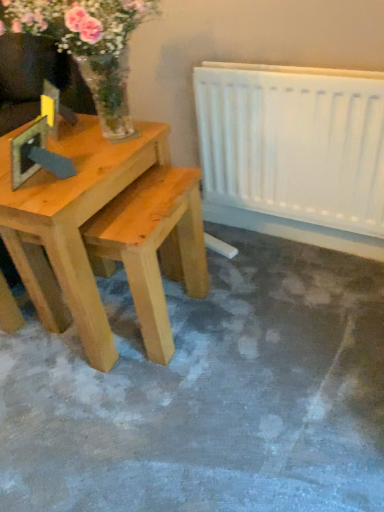
What do you see at coordinates (294, 142) in the screenshot?
I see `white plastic radiator at right` at bounding box center [294, 142].

At what (x,y) coordinates should I click in order to perform the action: click on light brown wood table at left. Please return your answer as a coordinate pair (x, y). Image resolution: width=384 pixels, height=512 pixels. Looking at the image, I should click on (73, 223).

How different are the orientations of white plastic radiator at right and translucent glass vase at upper left in degrees?

The facing directions of white plastic radiator at right and translucent glass vase at upper left are 3.17 degrees apart.

From the image's perspective, is white plastic radiator at right beneath translucent glass vase at upper left?

Correct, white plastic radiator at right appears lower than translucent glass vase at upper left in the image.

Is white plastic radiator at right not within translucent glass vase at upper left?

Yes, white plastic radiator at right is outside of translucent glass vase at upper left.

From a real-world perspective, relative to translucent glass vase at upper left, is white plastic radiator at right vertically above or below?

In terms of real-world spatial position, white plastic radiator at right is below translucent glass vase at upper left.

What's the angular difference between translucent glass vase at upper left and white plastic radiator at right's facing directions?

There is a 3.17-degree angle between the facing directions of translucent glass vase at upper left and white plastic radiator at right.

Considering the sizes of objects translucent glass vase at upper left and white plastic radiator at right in the image provided, who is taller, translucent glass vase at upper left or white plastic radiator at right?

white plastic radiator at right.

Consider the image. From a real-world perspective, is translucent glass vase at upper left physically located above or below white plastic radiator at right?

translucent glass vase at upper left is situated higher than white plastic radiator at right in the real world.

Would you say translucent glass vase at upper left is a long distance from white plastic radiator at right?

No.

In terms of height, does translucent glass vase at upper left look taller or shorter compared to light brown wood table at left?

In the image, translucent glass vase at upper left appears to be shorter than light brown wood table at left.

How different are the orientations of translucent glass vase at upper left and light brown wood table at left in degrees?

translucent glass vase at upper left and light brown wood table at left are facing 0.0865 degrees away from each other.

Is translucent glass vase at upper left turned away from light brown wood table at left?

No, light brown wood table at left is not at the back of translucent glass vase at upper left.

Which is correct: translucent glass vase at upper left is inside light brown wood table at left, or outside of it?

translucent glass vase at upper left is spatially situated outside light brown wood table at left.

Does white plastic radiator at right turn towards light brown wood table at left?

Yes, white plastic radiator at right is facing light brown wood table at left.

Is white plastic radiator at right far from light brown wood table at left?

No, white plastic radiator at right is not far from light brown wood table at left.

From a real-world perspective, is white plastic radiator at right physically located above or below light brown wood table at left?

white plastic radiator at right is above light brown wood table at left.

Find the location of a particular element. table lying in front of the white plastic radiator at right is located at coordinates (x=73, y=223).

Is light brown wood table at left taller or shorter than white plastic radiator at right?

Clearly, light brown wood table at left is taller compared to white plastic radiator at right.

From a real-world perspective, which is physically below, light brown wood table at left or white plastic radiator at right?

In real-world perspective, light brown wood table at left is lower.

Is light brown wood table at left far away from white plastic radiator at right?

No, light brown wood table at left is not far from white plastic radiator at right.

Is light brown wood table at left looking in the opposite direction of translucent glass vase at upper left?

No, translucent glass vase at upper left is not at the back of light brown wood table at left.

Considering the sizes of objects light brown wood table at left and translucent glass vase at upper left in the image provided, who is wider, light brown wood table at left or translucent glass vase at upper left?

light brown wood table at left is wider.

Is the position of light brown wood table at left less distant than that of translucent glass vase at upper left?

No, it is behind translucent glass vase at upper left.

From the image's perspective, which object appears higher, light brown wood table at left or translucent glass vase at upper left?

translucent glass vase at upper left, from the image's perspective.

At what (x,y) coordinates should I click in order to perform the action: click on floral arrangement in front of the white plastic radiator at right. Please return your answer as a coordinate pair (x, y). The image size is (384, 512). Looking at the image, I should click on (88, 45).

Find the location of a particular element. This screenshot has height=512, width=384. floral arrangement positioned vertically above the white plastic radiator at right (from a real-world perspective) is located at coordinates (88, 45).

When comparing their distances from light brown wood table at left, does translucent glass vase at upper left or white plastic radiator at right seem closer?

translucent glass vase at upper left.

Which object lies nearer to the anchor point light brown wood table at left, white plastic radiator at right or translucent glass vase at upper left?

The object closer to light brown wood table at left is translucent glass vase at upper left.

Estimate the real-world distances between objects in this image. Which object is closer to white plastic radiator at right, translucent glass vase at upper left or light brown wood table at left?

Based on the image, translucent glass vase at upper left appears to be nearer to white plastic radiator at right.

Estimate the real-world distances between objects in this image. Which object is closer to translucent glass vase at upper left, light brown wood table at left or white plastic radiator at right?

light brown wood table at left is positioned closer to the anchor translucent glass vase at upper left.

From the image, which object appears to be farther from white plastic radiator at right, light brown wood table at left or translucent glass vase at upper left?

light brown wood table at left is further to white plastic radiator at right.

Which object lies nearer to the anchor point translucent glass vase at upper left, white plastic radiator at right or light brown wood table at left?

The object closer to translucent glass vase at upper left is light brown wood table at left.

The height and width of the screenshot is (512, 384). What are the coordinates of `floral arrangement situated between light brown wood table at left and white plastic radiator at right from left to right` in the screenshot? It's located at (88, 45).